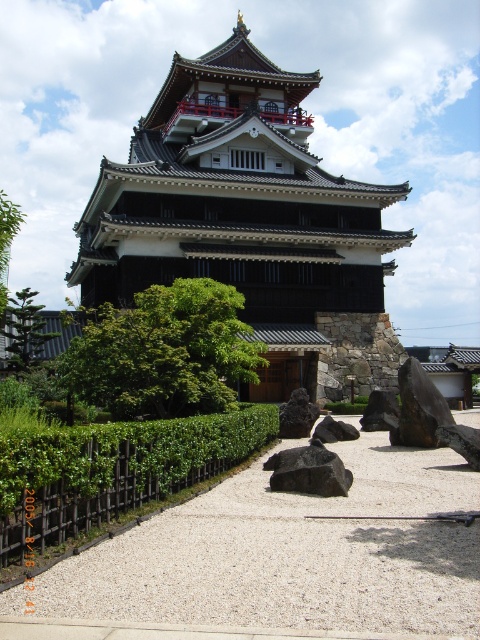
Who is lower down, black wooden pagoda at center or black rock at center?

black rock at center

Who is more distant from viewer, (x=228, y=128) or (x=343, y=426)?

Point (x=228, y=128)

Locate an element on the screen. Image resolution: width=480 pixels, height=640 pixels. black wooden pagoda at center is located at coordinates (249, 221).

Can you confirm if white gravel path at center is smaller than black smooth rock at center?

No, white gravel path at center is not smaller than black smooth rock at center.

Which is in front, point (465, 586) or point (302, 449)?

Point (465, 586) is more forward.

Is point (351, 612) positioned in front of point (276, 456)?

That is True.

Where is `white gravel path at center`? This screenshot has width=480, height=640. white gravel path at center is located at coordinates (280, 560).

Does green leafy tree at center appear over green leafy tree at left?

No, green leafy tree at center is not above green leafy tree at left.

Is green leafy tree at center to the right of green leafy tree at left from the viewer's perspective?

Indeed, green leafy tree at center is positioned on the right side of green leafy tree at left.

Identify the location of green leafy tree at center. The image size is (480, 640). (165, 353).